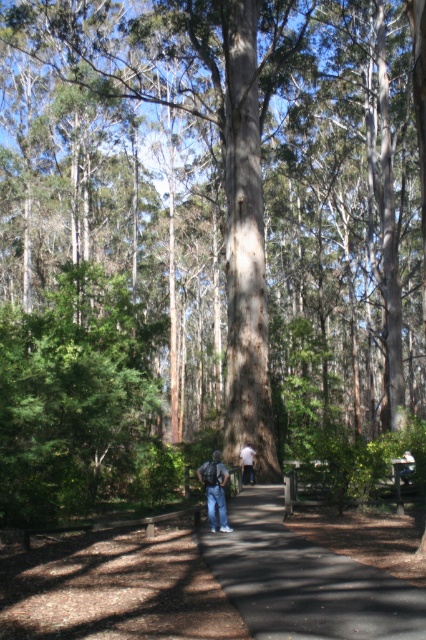
Question: Does dark brown asphalt at center appear under denim jeans at center?

Choices:
 (A) yes
 (B) no

Answer: (A)

Question: Which of the following is the closest to the observer?

Choices:
 (A) denim jeans at center
 (B) white cotton shirt at center
 (C) dark brown asphalt at center

Answer: (C)

Question: Which of these objects is positioned closest to the dark brown asphalt at center?

Choices:
 (A) white cotton shirt at center
 (B) denim jeans at center

Answer: (B)

Question: Is dark brown asphalt at center positioned at the back of denim jeans at center?

Choices:
 (A) yes
 (B) no

Answer: (B)

Question: Among these points, which one is farthest from the camera?

Choices:
 (A) (242, 467)
 (B) (204, 465)
 (C) (417, 632)

Answer: (A)

Question: Is dark brown asphalt at center bigger than white cotton shirt at center?

Choices:
 (A) no
 (B) yes

Answer: (B)